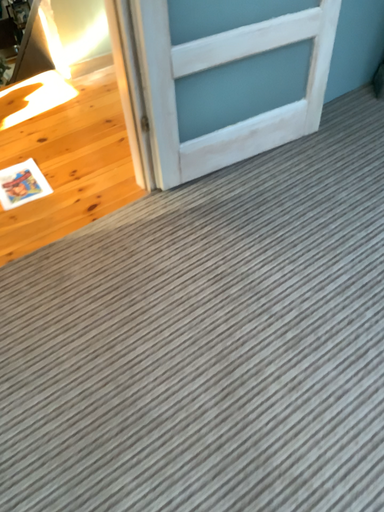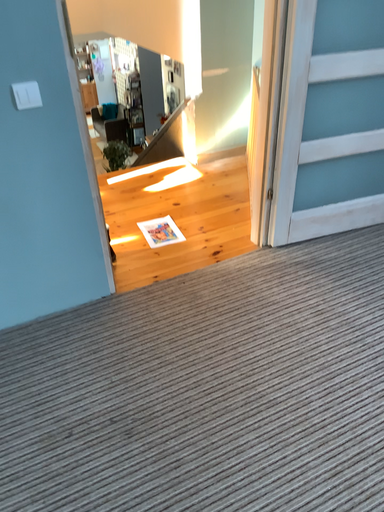
Question: Which way did the camera rotate in the video?

Choices:
 (A) rotated downward
 (B) rotated upward

Answer: (B)